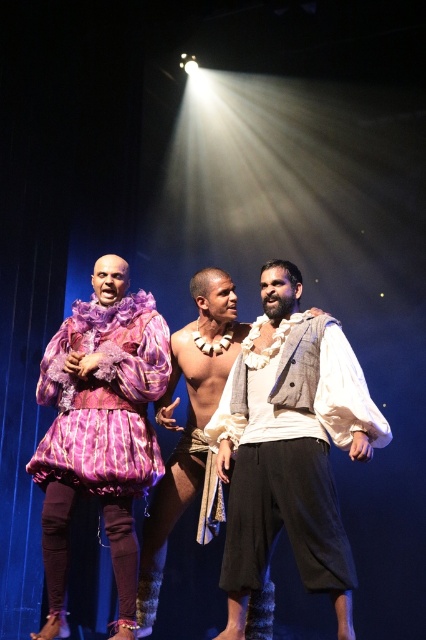
Does white cotton shirt at center lie in front of matte purple fabric dress at left?

Yes, white cotton shirt at center is in front of matte purple fabric dress at left.

Which is above, white cotton shirt at center or matte purple fabric dress at left?

matte purple fabric dress at left

Does point (252, 474) lie behind point (164, 323)?

No, (252, 474) is in front of (164, 323).

Locate an element on the screen. The width and height of the screenshot is (426, 640). white cotton shirt at center is located at coordinates 290,458.

Between white cotton shirt at center and white textured scarf at center, which one has less height?

Standing shorter between the two is white cotton shirt at center.

In the scene shown: Does white cotton shirt at center appear under white textured scarf at center?

No, white cotton shirt at center is not below white textured scarf at center.

Identify the location of white cotton shirt at center. The image size is (426, 640). (290, 458).

Locate an element on the screen. The height and width of the screenshot is (640, 426). white cotton shirt at center is located at coordinates (290, 458).

Looking at this image, does matte purple fabric dress at left appear over white textured scarf at center?

Correct, matte purple fabric dress at left is located above white textured scarf at center.

Who is lower down, matte purple fabric dress at left or white textured scarf at center?

Positioned lower is white textured scarf at center.

Which is in front, point (98, 312) or point (201, 397)?

Point (201, 397) is more forward.

Where is `matte purple fabric dress at left`? The image size is (426, 640). matte purple fabric dress at left is located at coordinates (104, 397).